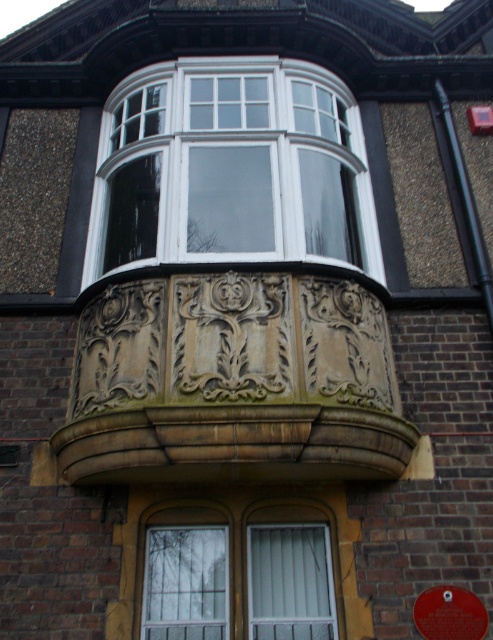
Question: Which point is closer to the camera?

Choices:
 (A) 314,84
 (B) 342,332

Answer: (B)

Question: Is carved stone balcony at center wider than white textured glass at lower center?

Choices:
 (A) no
 (B) yes

Answer: (B)

Question: Is white glossy bay window at upper center thinner than white textured glass at lower center?

Choices:
 (A) no
 (B) yes

Answer: (A)

Question: Which of the following is the closest to the observer?

Choices:
 (A) white glossy bay window at upper center
 (B) white textured glass at lower center
 (C) carved stone balcony at center

Answer: (C)

Question: Estimate the real-world distances between objects in this image. Which object is closer to the carved stone balcony at center?

Choices:
 (A) white glossy bay window at upper center
 (B) white textured glass at lower center

Answer: (B)

Question: Is white glossy bay window at upper center wider than white textured glass at lower center?

Choices:
 (A) no
 (B) yes

Answer: (B)